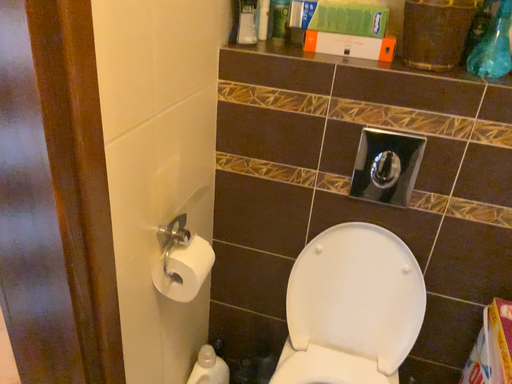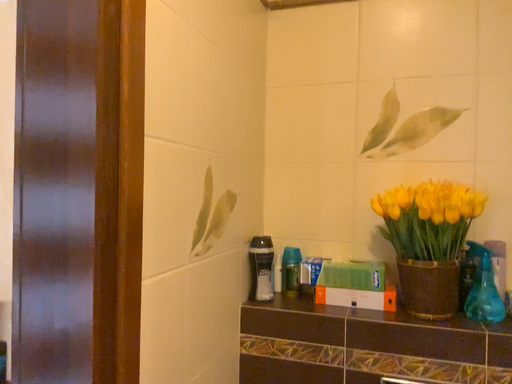
Question: How did the camera likely rotate when shooting the video?

Choices:
 (A) rotated downward
 (B) rotated upward

Answer: (B)